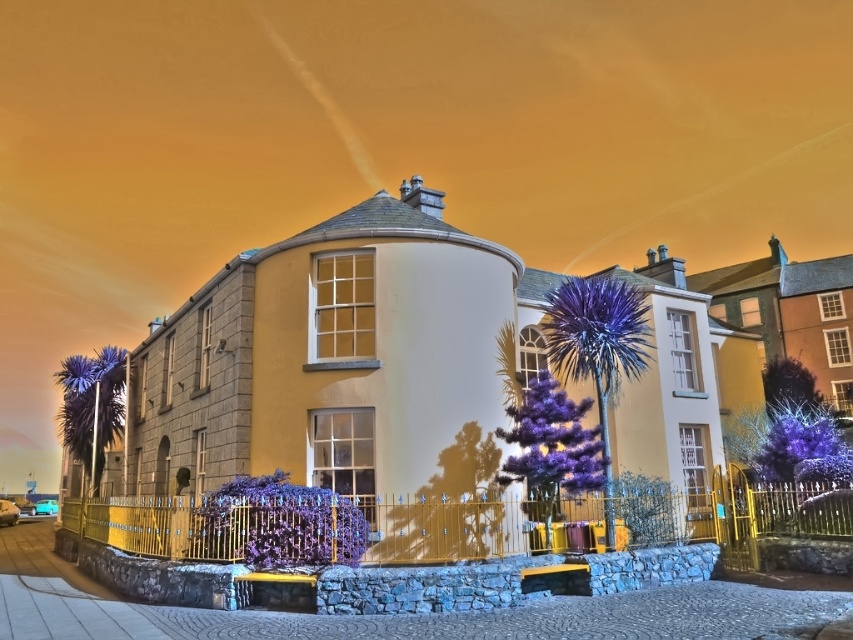
Question: Which of the following is the farthest from the observer?

Choices:
 (A) (64, 388)
 (B) (564, 305)

Answer: (A)

Question: Can you confirm if purple metallic palm tree at center is positioned above purple spiky palm at left?

Choices:
 (A) yes
 (B) no

Answer: (A)

Question: Does purple metallic palm tree at center come behind purple spiky palm at left?

Choices:
 (A) no
 (B) yes

Answer: (A)

Question: Is purple metallic palm tree at center smaller than purple spiky palm at left?

Choices:
 (A) no
 (B) yes

Answer: (A)